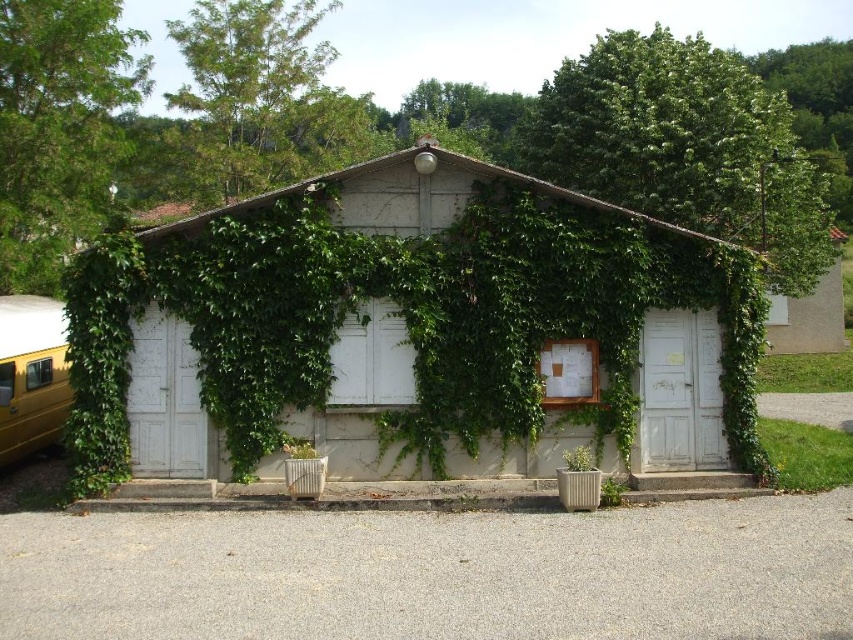
You are standing in front of the quaint, rustic building described in the scene. There is a point marked at coordinates (x=403, y=316). What does this point represent?

The point at coordinates (x=403, y=316) represents the green ivycovered hut at center.